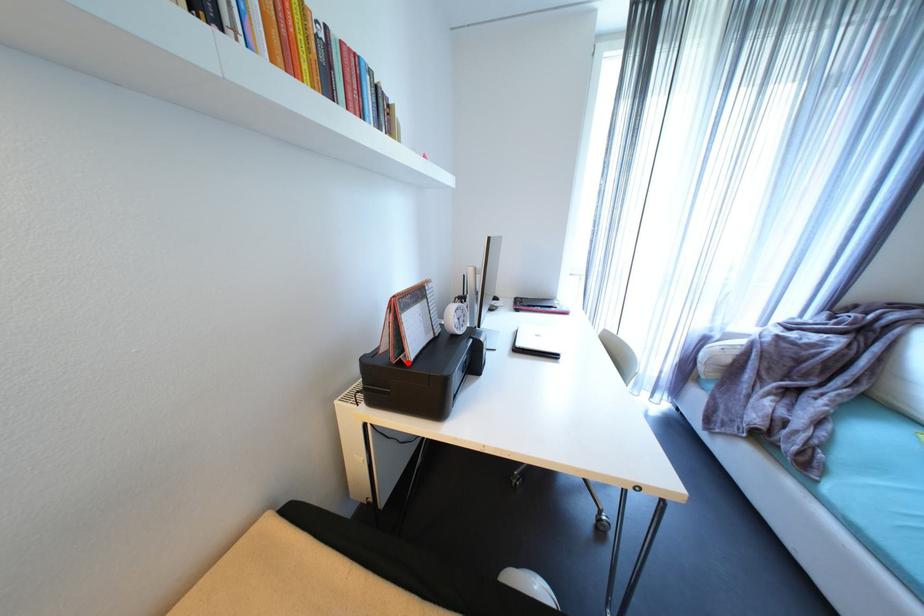
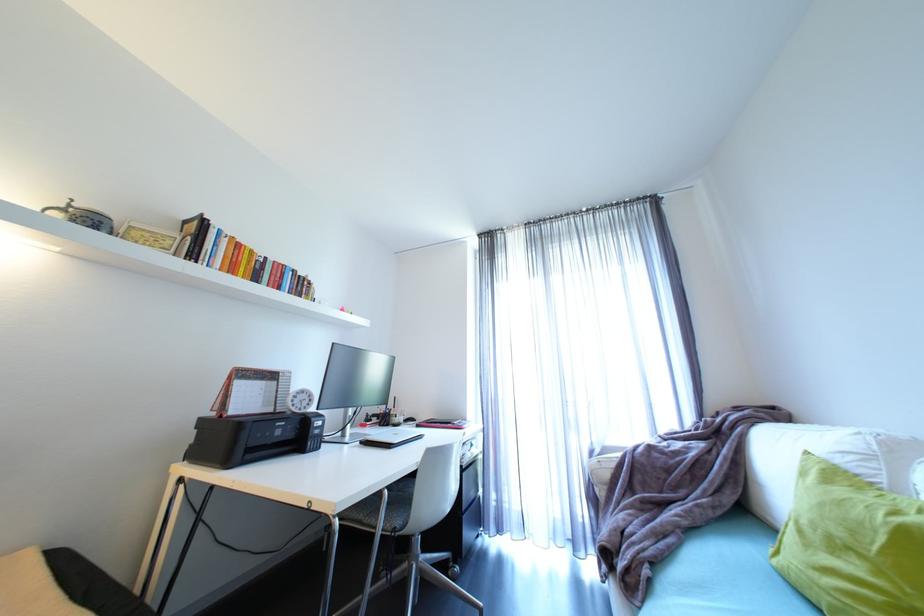
Question: I am providing you with two images of the same scene from different viewpoints. A red point is marked on the first image. Can you still see the location of the red point in image 2?

Choices:
 (A) Yes
 (B) No

Answer: (A)